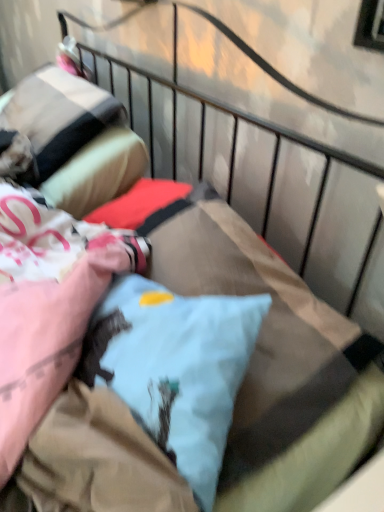
Locate an element on the screen. Image resolution: width=384 pixels, height=512 pixels. light blue fabric pillow at center is located at coordinates (175, 368).

What do you see at coordinates (175, 368) in the screenshot? The image size is (384, 512). I see `light blue fabric pillow at center` at bounding box center [175, 368].

What is the approximate width of light blue fabric pillow at center?

light blue fabric pillow at center is 14.28 inches wide.

I want to click on light blue fabric pillow at center, so [175, 368].